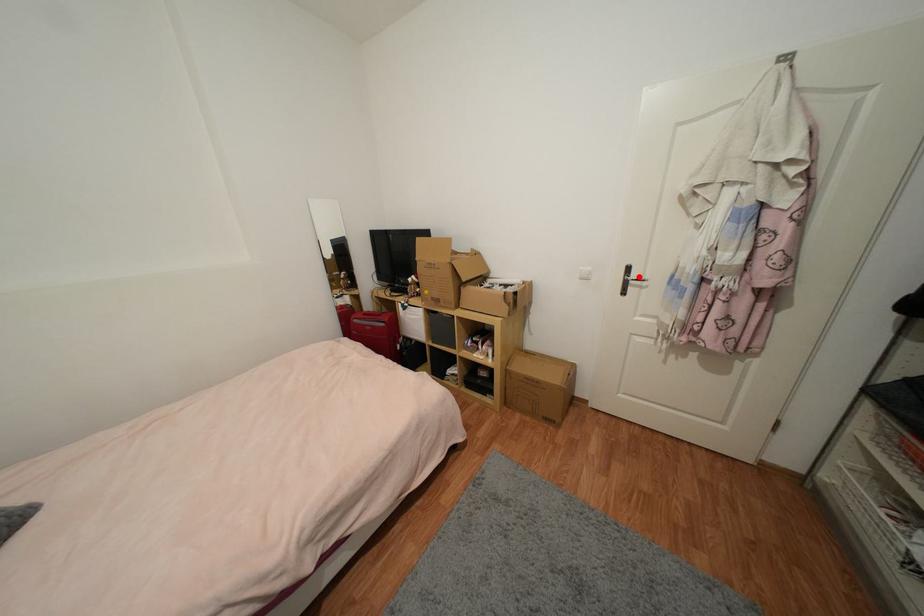
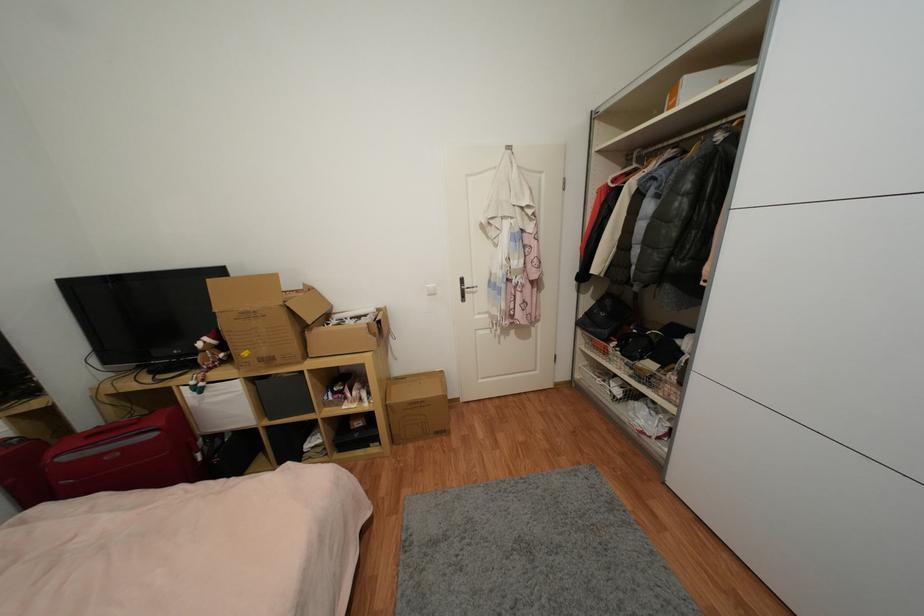
The point at the highlighted location is marked in the first image. Where is the corresponding point in the second image?

(471, 286)